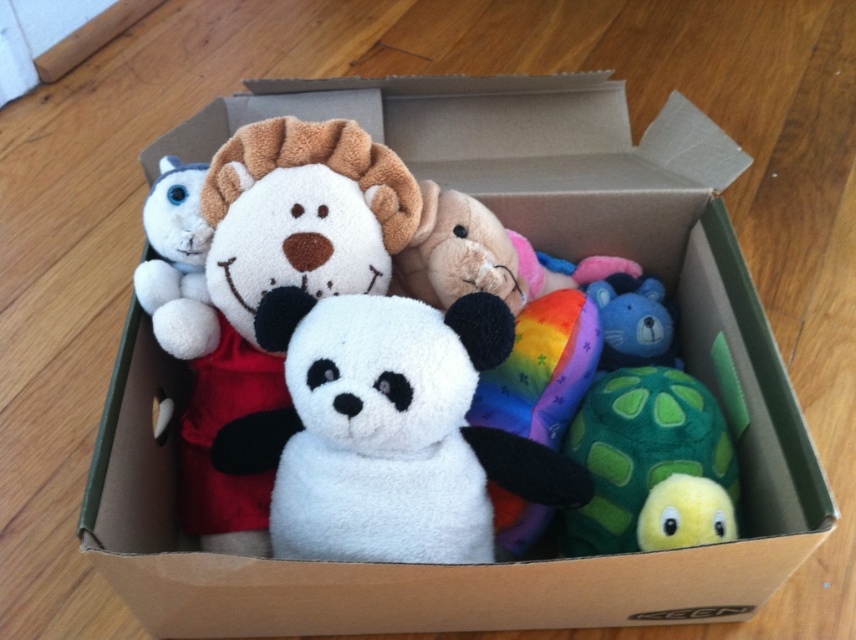
At what (x,y) coordinates should I click in order to perform the action: click on green fuzzy turtle at lower right. Please return your answer as a coordinate pair (x, y). This screenshot has height=640, width=856. Looking at the image, I should click on (651, 465).

Who is shorter, green fuzzy turtle at lower right or yellow fuzzy bird at lower right?

yellow fuzzy bird at lower right is shorter.

Who is more distant from viewer, (609, 417) or (663, 515)?

The point (609, 417) is behind.

At what (x,y) coordinates should I click in order to perform the action: click on green fuzzy turtle at lower right. Please return your answer as a coordinate pair (x, y). Image resolution: width=856 pixels, height=640 pixels. Looking at the image, I should click on (651, 465).

Can you confirm if white plush panda at center is bigger than green fuzzy turtle at lower right?

Yes.

Is point (483, 499) positioned behind point (643, 454)?

That is False.

In the scene shown: Who is more distant from viewer, (465, 397) or (667, 509)?

The point (465, 397) is behind.

Where is `white plush panda at center`? The height and width of the screenshot is (640, 856). white plush panda at center is located at coordinates (394, 429).

Does white plush cat at upper left appear over yellow fuzzy bird at lower right?

Yes.

Who is more forward, (197, 218) or (687, 536)?

Point (687, 536) is in front.

Identify the location of white plush cat at upper left. (177, 262).